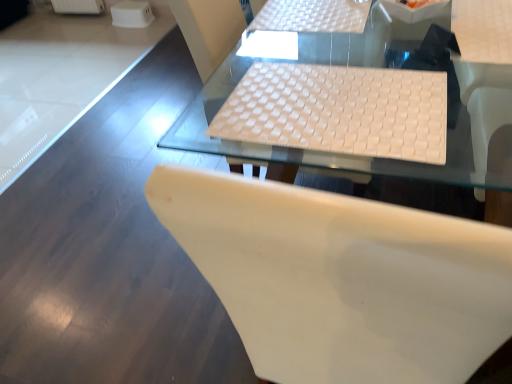
What do you see at coordinates (312, 16) in the screenshot?
I see `white woven mat at upper center, which is counted as the first table, starting from the top` at bounding box center [312, 16].

The image size is (512, 384). What do you see at coordinates (366, 157) in the screenshot?
I see `white woven mat at center, the second table in the top-to-bottom sequence` at bounding box center [366, 157].

This screenshot has height=384, width=512. I want to click on white matte chair at center, so [x=341, y=279].

From the image's perspective, would you say white woven mat at center, the second table in the top-to-bottom sequence, is positioned over white woven mat at upper center, which is counted as the second table, starting from the bottom?

Incorrect, from the image's perspective, white woven mat at center, the second table in the top-to-bottom sequence, is lower than white woven mat at upper center, which is counted as the second table, starting from the bottom.

From the picture: Is white woven mat at center, the second table in the top-to-bottom sequence, facing away from white woven mat at upper center, which is counted as the first table, starting from the top?

No, white woven mat at center, the second table in the top-to-bottom sequence, is not facing away from white woven mat at upper center, which is counted as the first table, starting from the top.

Does point (475, 147) lie behind point (315, 31)?

No, (475, 147) is closer to viewer.

Between white woven fabric laptop keyboard at center and white woven mat at center, the second table in the top-to-bottom sequence, which one has smaller size?

white woven fabric laptop keyboard at center.

Is white woven fabric laptop keyboard at center facing away from white woven mat at center, the second table in the top-to-bottom sequence?

No, white woven mat at center, the second table in the top-to-bottom sequence, is not at the back of white woven fabric laptop keyboard at center.

From the image's perspective, which is above, white woven fabric laptop keyboard at center or white woven mat at center, which is counted as the first table, starting from the bottom?

white woven mat at center, which is counted as the first table, starting from the bottom.

Does white woven fabric laptop keyboard at center have a lesser height compared to white woven mat at center, which is counted as the first table, starting from the bottom?

Yes, white woven fabric laptop keyboard at center is shorter than white woven mat at center, which is counted as the first table, starting from the bottom.

What's the angular difference between white woven mat at upper center, which is counted as the second table, starting from the bottom, and white woven mat at center, which is counted as the first table, starting from the bottom,'s facing directions?

4.49 degrees.

From the image's perspective, between white woven mat at upper center, which is counted as the first table, starting from the top, and white woven mat at center, the second table in the top-to-bottom sequence, who is located below?

white woven mat at center, the second table in the top-to-bottom sequence.

Which of these two, white woven mat at upper center, which is counted as the second table, starting from the bottom, or white woven mat at center, the second table in the top-to-bottom sequence, is smaller?

white woven mat at upper center, which is counted as the second table, starting from the bottom.

Is white woven mat at center, the second table in the top-to-bottom sequence, completely or partially inside white woven mat at upper center, which is counted as the first table, starting from the top?

That's incorrect, white woven mat at center, the second table in the top-to-bottom sequence, is not inside white woven mat at upper center, which is counted as the first table, starting from the top.

Which of these two, white matte chair at center or white woven mat at upper center, which is counted as the first table, starting from the top, is smaller?

With smaller size is white woven mat at upper center, which is counted as the first table, starting from the top.

Is white matte chair at center not within white woven mat at upper center, which is counted as the second table, starting from the bottom?

Yes, white matte chair at center is not within white woven mat at upper center, which is counted as the second table, starting from the bottom.

Between white matte chair at center and white woven mat at upper center, which is counted as the first table, starting from the top, which one has larger width?

white matte chair at center is wider.

Is white woven mat at center, which is counted as the first table, starting from the bottom, positioned in front of white matte chair at center?

That is False.

Is white woven mat at center, which is counted as the first table, starting from the bottom, next to white matte chair at center and touching it?

No, white woven mat at center, which is counted as the first table, starting from the bottom, is not making contact with white matte chair at center.

Does white woven mat at center, which is counted as the first table, starting from the bottom, have a larger size compared to white matte chair at center?

No, white woven mat at center, which is counted as the first table, starting from the bottom, is not bigger than white matte chair at center.

Does point (478, 130) lie behind point (421, 219)?

Yes, point (478, 130) is farther from viewer.

Consider the image. Measure the distance between white woven fabric laptop keyboard at center and white matte chair at center.

They are 18.10 inches apart.

From the image's perspective, who appears lower, white woven fabric laptop keyboard at center or white matte chair at center?

From the image's view, white woven fabric laptop keyboard at center is below.

Considering the positions of objects white woven fabric laptop keyboard at center and white matte chair at center in the image provided, who is more to the left, white woven fabric laptop keyboard at center or white matte chair at center?

white woven fabric laptop keyboard at center is more to the left.

Considering the relative sizes of white woven fabric laptop keyboard at center and white matte chair at center in the image provided, is white woven fabric laptop keyboard at center wider than white matte chair at center?

No, white woven fabric laptop keyboard at center is not wider than white matte chair at center.

Which object is closer to the camera taking this photo, white matte chair at center or white woven mat at center, which is counted as the first table, starting from the bottom?

white matte chair at center is closer to the camera.

How different are the orientations of white matte chair at center and white woven mat at center, which is counted as the first table, starting from the bottom, in degrees?

They differ by 177 degrees in their facing directions.

Is white matte chair at center oriented towards white woven mat at center, which is counted as the first table, starting from the bottom?

Yes, white matte chair at center is turned towards white woven mat at center, which is counted as the first table, starting from the bottom.

From a real-world perspective, is white matte chair at center above or below white woven mat at center, the second table in the top-to-bottom sequence?

white matte chair at center is situated lower than white woven mat at center, the second table in the top-to-bottom sequence, in the real world.

Find the location of a particular element. Image resolution: width=512 pixels, height=384 pixels. table in front of the white woven mat at upper center, which is counted as the second table, starting from the bottom is located at coordinates (366, 157).

Locate an element on the screen. laptop keyboard above the white woven mat at center, the second table in the top-to-bottom sequence (from a real-world perspective) is located at coordinates (339, 111).

When comparing their distances from white woven fabric laptop keyboard at center, does white woven mat at center, which is counted as the first table, starting from the bottom, or white matte chair at center seem closer?

Among the two, white woven mat at center, which is counted as the first table, starting from the bottom, is located nearer to white woven fabric laptop keyboard at center.

Based on their spatial positions, is white woven mat at upper center, which is counted as the second table, starting from the bottom, or white woven fabric laptop keyboard at center further from white matte chair at center?

Based on the image, white woven mat at upper center, which is counted as the second table, starting from the bottom, appears to be further to white matte chair at center.

Looking at the image, which one is located closer to white woven fabric laptop keyboard at center, white woven mat at upper center, which is counted as the second table, starting from the bottom, or white woven mat at center, which is counted as the first table, starting from the bottom?

white woven mat at center, which is counted as the first table, starting from the bottom.

Considering their positions, is white woven mat at center, the second table in the top-to-bottom sequence, positioned further to white woven mat at upper center, which is counted as the first table, starting from the top, than white matte chair at center?

white matte chair at center is positioned further to the anchor white woven mat at upper center, which is counted as the first table, starting from the top.

When comparing their distances from white matte chair at center, does white woven fabric laptop keyboard at center or white woven mat at upper center, which is counted as the second table, starting from the bottom, seem further?

white woven mat at upper center, which is counted as the second table, starting from the bottom, lies further to white matte chair at center than the other object.

Based on their spatial positions, is white woven mat at upper center, which is counted as the second table, starting from the bottom, or white matte chair at center further from white woven fabric laptop keyboard at center?

white woven mat at upper center, which is counted as the second table, starting from the bottom, lies further to white woven fabric laptop keyboard at center than the other object.

Considering their positions, is white matte chair at center positioned further to white woven mat at center, which is counted as the first table, starting from the bottom, than white woven mat at upper center, which is counted as the second table, starting from the bottom?

white matte chair at center lies further to white woven mat at center, which is counted as the first table, starting from the bottom, than the other object.

Which object lies further to the anchor point white matte chair at center, white woven mat at upper center, which is counted as the first table, starting from the top, or white woven mat at center, which is counted as the first table, starting from the bottom?

Based on the image, white woven mat at upper center, which is counted as the first table, starting from the top, appears to be further to white matte chair at center.

Identify the location of laptop keyboard between white woven mat at center, the second table in the top-to-bottom sequence, and white matte chair at center. (339, 111).

Identify the location of table between white woven fabric laptop keyboard at center and white woven mat at upper center, which is counted as the first table, starting from the top, along the z-axis. (366, 157).

Find the location of a particular element. This screenshot has height=384, width=512. table positioned between white matte chair at center and white woven mat at upper center, which is counted as the first table, starting from the top, from near to far is located at coordinates (366, 157).

Where is `laptop keyboard between white matte chair at center and white woven mat at upper center, which is counted as the first table, starting from the top, from front to back`? laptop keyboard between white matte chair at center and white woven mat at upper center, which is counted as the first table, starting from the top, from front to back is located at coordinates (339, 111).